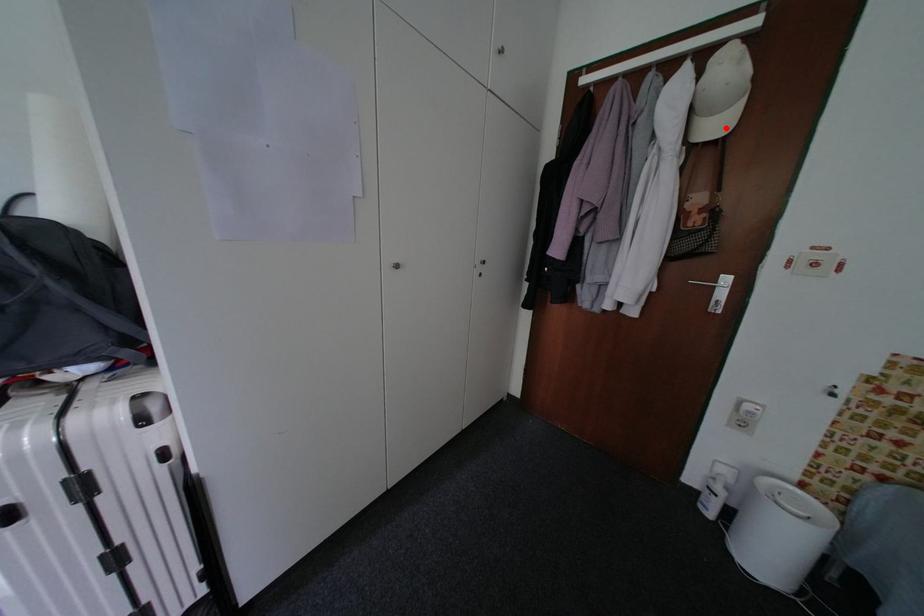
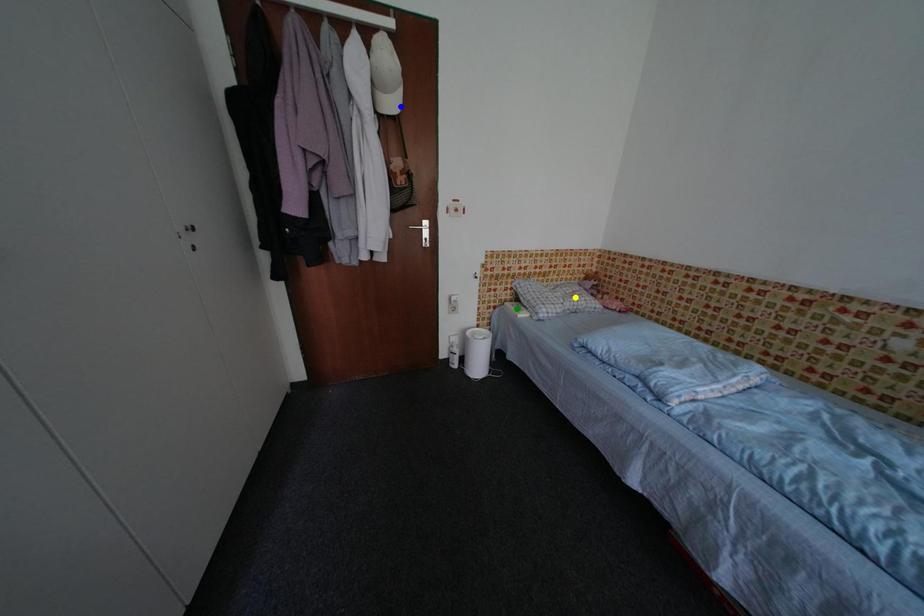
Question: I am providing you with two images of the same scene from different viewpoints. A red point is marked on the first image. You are given multiple points on the second image. Which point in image 2 is actually the same real-world point as the red point in image 1?

Choices:
 (A) green point
 (B) blue point
 (C) yellow point

Answer: (B)